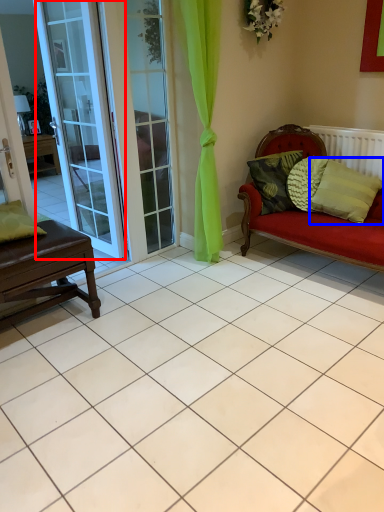
Question: Which object appears closest to the camera in this image, door (highlighted by a red box) or pillow (highlighted by a blue box)?

Choices:
 (A) door
 (B) pillow

Answer: (A)